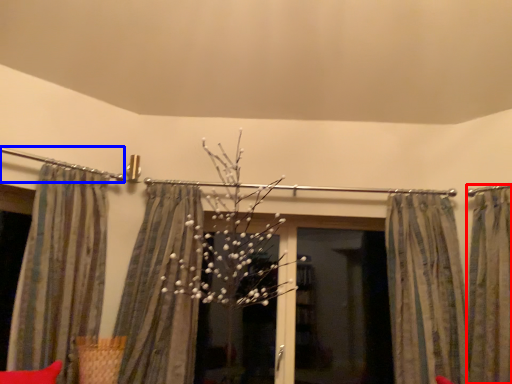
Question: Which object is further to the camera taking this photo, curtain (highlighted by a red box) or clothesline (highlighted by a blue box)?

Choices:
 (A) curtain
 (B) clothesline

Answer: (B)